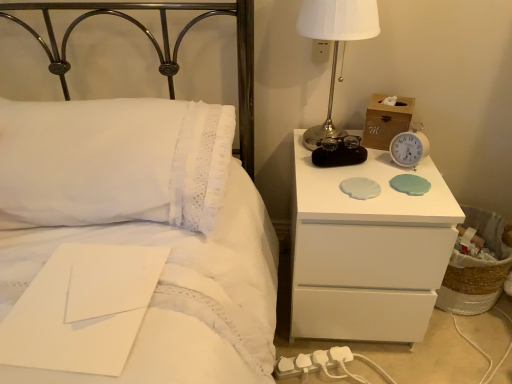
This screenshot has height=384, width=512. I want to click on white plastic alarm clock at upper right, which is counted as the 2th alarm clock, starting from the right, so click(339, 152).

This screenshot has width=512, height=384. I want to click on white plastic charger at lower center, so click(315, 363).

The height and width of the screenshot is (384, 512). Identify the location of woven straw basket at lower right. (476, 268).

Where is `silver metallic bedside lamp at upper right`? silver metallic bedside lamp at upper right is located at coordinates (335, 44).

Find the location of a particular element. white plastic electric outlet at upper center is located at coordinates click(x=320, y=51).

Describe the element at coordinates (82, 309) in the screenshot. I see `white paper at lower left` at that location.

Locate an element on the screen. wooden tissue box at upper right is located at coordinates (386, 121).

You are a GUI agent. You are given a task and a screenshot of the screen. Output one action in this format:
    pyautogui.click(x=<x>, y=<y>)
    Task: Click on the white plastic alarm clock at upper right, marked as the first alarm clock in a left-to-right arrangement
    
    Given the screenshot: What is the action you would take?
    pyautogui.click(x=339, y=152)

Where is `electric outlet that appears above the white plastic alarm clock at upper right, the first alarm clock from the right (from the image's perspective)`? Image resolution: width=512 pixels, height=384 pixels. electric outlet that appears above the white plastic alarm clock at upper right, the first alarm clock from the right (from the image's perspective) is located at coordinates (320, 51).

Which is nearer, [412,141] or [324,54]?

Point [412,141] is positioned closer to the camera compared to point [324,54].

Is white plastic alarm clock at upper right, the first alarm clock from the right, oriented away from white plastic electric outlet at upper center?

white plastic alarm clock at upper right, the first alarm clock from the right, does not have its back to white plastic electric outlet at upper center.

How many degrees apart are the facing directions of white plastic alarm clock at upper right, the 2th alarm clock viewed from the left, and white plastic electric outlet at upper center?

31.6 degrees.

Considering the relative sizes of white plastic alarm clock at upper right, the first alarm clock from the right, and white lace pillow at upper left in the image provided, is white plastic alarm clock at upper right, the first alarm clock from the right, bigger than white lace pillow at upper left?

No.

Measure the distance from white plastic alarm clock at upper right, the 2th alarm clock viewed from the left, to white lace pillow at upper left.

white plastic alarm clock at upper right, the 2th alarm clock viewed from the left, and white lace pillow at upper left are 27.20 inches apart.

From the picture: Choose the correct answer: Is white plastic alarm clock at upper right, the first alarm clock from the right, inside white lace pillow at upper left or outside it?

white plastic alarm clock at upper right, the first alarm clock from the right, is spatially situated outside white lace pillow at upper left.

From a real-world perspective, between white plastic alarm clock at upper right, the first alarm clock from the right, and white lace pillow at upper left, who is vertically lower?

In real-world perspective, white lace pillow at upper left is lower.

Between white glossy nightstand at right and white paper at lower left, which one has less height?

white paper at lower left.

Does white glossy nightstand at right turn towards white paper at lower left?

No, white glossy nightstand at right does not turn towards white paper at lower left.

Between white glossy nightstand at right and white paper at lower left, which one appears on the right side from the viewer's perspective?

From the viewer's perspective, white glossy nightstand at right appears more on the right side.

Is point (320, 188) positioned behind point (9, 359)?

That is True.

Could you tell me if white lace pillow at upper left is turned towards woven straw basket at lower right?

No, white lace pillow at upper left is not oriented towards woven straw basket at lower right.

Between point (173, 181) and point (464, 228), which one is positioned in front?

The point (173, 181) is closer.

From the image's perspective, relative to woven straw basket at lower right, is white lace pillow at upper left above or below?

Based on their image positions, white lace pillow at upper left is located above woven straw basket at lower right.

Can you confirm if white lace pillow at upper left is bigger than silver metallic bedside lamp at upper right?

Yes.

From the picture: Is white lace pillow at upper left turned away from silver metallic bedside lamp at upper right?

No, white lace pillow at upper left is not facing away from silver metallic bedside lamp at upper right.

From the image's perspective, is white lace pillow at upper left above or below silver metallic bedside lamp at upper right?

white lace pillow at upper left is situated lower than silver metallic bedside lamp at upper right in the image.

From a real-world perspective, which is physically above, white lace pillow at upper left or silver metallic bedside lamp at upper right?

silver metallic bedside lamp at upper right, from a real-world perspective.

Is white plastic alarm clock at upper right, which is counted as the 2th alarm clock, starting from the right, oriented away from wooden tissue box at upper right?

white plastic alarm clock at upper right, which is counted as the 2th alarm clock, starting from the right, does not have its back to wooden tissue box at upper right.

From the image's perspective, would you say white plastic alarm clock at upper right, which is counted as the 2th alarm clock, starting from the right, is positioned over wooden tissue box at upper right?

No, from the image's perspective, white plastic alarm clock at upper right, which is counted as the 2th alarm clock, starting from the right, is not over wooden tissue box at upper right.

Is point (359, 142) closer or farther from the camera than point (407, 125)?

Clearly, point (359, 142) is more distant from the camera than point (407, 125).

Which object is wider, white plastic alarm clock at upper right, marked as the first alarm clock in a left-to-right arrangement, or wooden tissue box at upper right?

Wider between the two is wooden tissue box at upper right.

Considering the sizes of objects white plastic alarm clock at upper right, marked as the first alarm clock in a left-to-right arrangement, and white lace pillow at upper left in the image provided, who is bigger, white plastic alarm clock at upper right, marked as the first alarm clock in a left-to-right arrangement, or white lace pillow at upper left?

With larger size is white lace pillow at upper left.

From a real-world perspective, is white plastic alarm clock at upper right, marked as the first alarm clock in a left-to-right arrangement, under white lace pillow at upper left?

Correct, in the physical world, white plastic alarm clock at upper right, marked as the first alarm clock in a left-to-right arrangement, is lower than white lace pillow at upper left.

Looking at this image, considering the positions of objects white plastic alarm clock at upper right, which is counted as the 2th alarm clock, starting from the right, and white lace pillow at upper left in the image provided, who is more to the left, white plastic alarm clock at upper right, which is counted as the 2th alarm clock, starting from the right, or white lace pillow at upper left?

white lace pillow at upper left is more to the left.

This screenshot has width=512, height=384. Identify the location of alarm clock beneath the white lace pillow at upper left (from a real-world perspective). (339, 152).

The width and height of the screenshot is (512, 384). Identify the location of electric outlet located behind the white plastic alarm clock at upper right, the 2th alarm clock viewed from the left. (320, 51).

This screenshot has height=384, width=512. I want to click on bed below the white plastic alarm clock at upper right, the 2th alarm clock viewed from the left (from the image's perspective), so click(x=145, y=228).

Estimate the real-world distances between objects in this image. Which object is further from woven straw basket at lower right, white plastic charger at lower center or white plastic electric outlet at upper center?

The object further to woven straw basket at lower right is white plastic electric outlet at upper center.

When comparing their distances from white plastic charger at lower center, does white paper at lower left or white plastic alarm clock at upper right, the first alarm clock from the right, seem further?

Based on the image, white paper at lower left appears to be further to white plastic charger at lower center.

When comparing their distances from white plastic charger at lower center, does white paper at lower left or white lace pillow at upper left seem further?

The object further to white plastic charger at lower center is white paper at lower left.

Which object lies nearer to the anchor point white paper at lower left, white plastic alarm clock at upper right, marked as the first alarm clock in a left-to-right arrangement, or white plastic charger at lower center?

white plastic charger at lower center is closer to white paper at lower left.

Considering their positions, is wooden tissue box at upper right positioned further to white plastic alarm clock at upper right, the first alarm clock from the right, than white lace pillow at upper left?

Among the two, white lace pillow at upper left is located further to white plastic alarm clock at upper right, the first alarm clock from the right.

Estimate the real-world distances between objects in this image. Which object is closer to white plastic charger at lower center, white plastic alarm clock at upper right, the first alarm clock from the right, or white lace pillow at upper left?

white plastic alarm clock at upper right, the first alarm clock from the right, lies closer to white plastic charger at lower center than the other object.

Considering their positions, is white paper at lower left positioned further to silver metallic bedside lamp at upper right than white plastic alarm clock at upper right, which is counted as the 2th alarm clock, starting from the right?

Among the two, white paper at lower left is located further to silver metallic bedside lamp at upper right.

Based on their spatial positions, is white lace pillow at upper left or woven straw basket at lower right closer to white plastic alarm clock at upper right, marked as the first alarm clock in a left-to-right arrangement?

white lace pillow at upper left is closer to white plastic alarm clock at upper right, marked as the first alarm clock in a left-to-right arrangement.

Image resolution: width=512 pixels, height=384 pixels. In order to click on nightstand between white plastic alarm clock at upper right, marked as the first alarm clock in a left-to-right arrangement, and white plastic charger at lower center, in the vertical direction in this screenshot , I will do `click(367, 251)`.

Find the location of a particular element. This screenshot has width=512, height=384. bedside lamp between white lace pillow at upper left and white glossy nightstand at right from left to right is located at coordinates (335, 44).

Locate an element on the screen. This screenshot has width=512, height=384. alarm clock between white lace pillow at upper left and white plastic alarm clock at upper right, the first alarm clock from the right is located at coordinates (339, 152).

Locate an element on the screen. This screenshot has width=512, height=384. pillow that lies between white plastic electric outlet at upper center and white plastic charger at lower center from top to bottom is located at coordinates (114, 161).